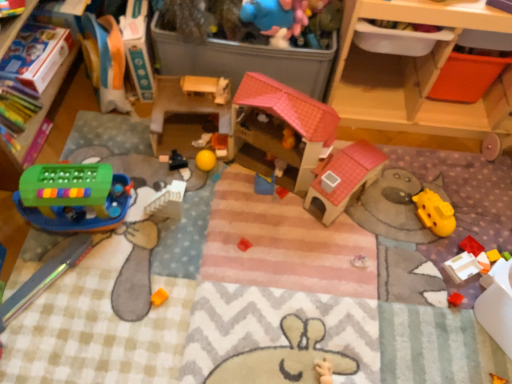
This screenshot has width=512, height=384. I want to click on free space on the front side of wooden drawer at upper right, so click(410, 201).